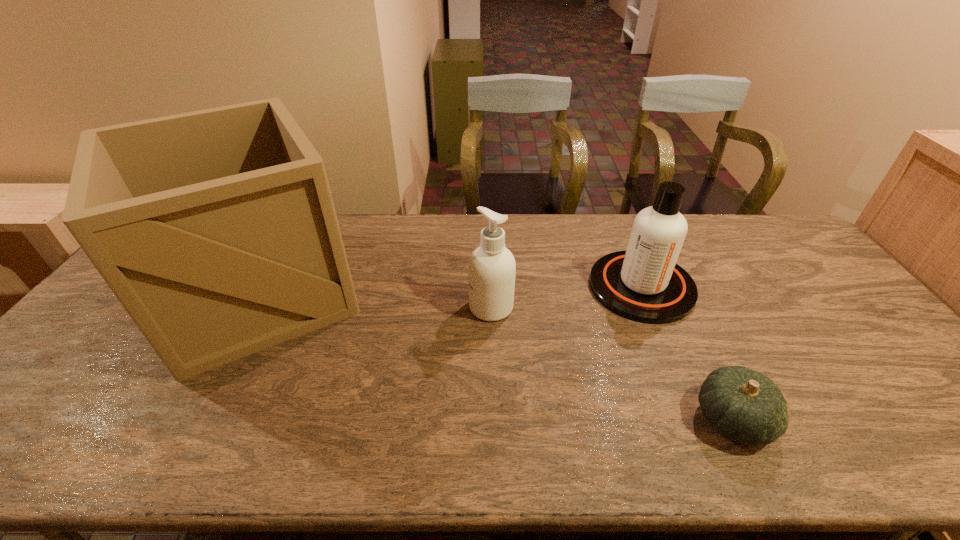
Locate an element on the screen. This screenshot has height=540, width=960. vacant space at the near right corner of the desktop is located at coordinates (941, 457).

This screenshot has height=540, width=960. What are the coordinates of `free area in between the gourd and the tallest object` in the screenshot? It's located at (496, 356).

This screenshot has width=960, height=540. In order to click on free area in between the tallest object and the gourd in this screenshot , I will do `click(496, 356)`.

Identify the location of free spot between the second object from left to right and the nearest object. This screenshot has width=960, height=540. (612, 363).

You are a GUI agent. You are given a task and a screenshot of the screen. Output one action in this format:
    pyautogui.click(x=<x>, y=<y>)
    Task: Click on the free space between the right cleansing agent and the second object from left to right
    
    Given the screenshot: What is the action you would take?
    pyautogui.click(x=566, y=297)

I want to click on free space between the gourd and the leftmost object, so click(496, 356).

This screenshot has width=960, height=540. I want to click on empty space that is in between the leftmost object and the shortest object, so click(496, 356).

You are a GUI agent. You are given a task and a screenshot of the screen. Output one action in this format:
    pyautogui.click(x=<x>, y=<y>)
    Task: Click on the vacant space that is in between the left cleansing agent and the gourd
    This screenshot has height=540, width=960.
    Given the screenshot: What is the action you would take?
    612,363

The height and width of the screenshot is (540, 960). Identify the location of vacant region between the box and the right cleansing agent. (450, 290).

You are a GUI agent. You are given a task and a screenshot of the screen. Output one action in this format:
    pyautogui.click(x=<x>, y=<y>)
    Task: Click on the free space between the tallest object and the right cleansing agent
    The height and width of the screenshot is (540, 960).
    Given the screenshot: What is the action you would take?
    pyautogui.click(x=450, y=290)